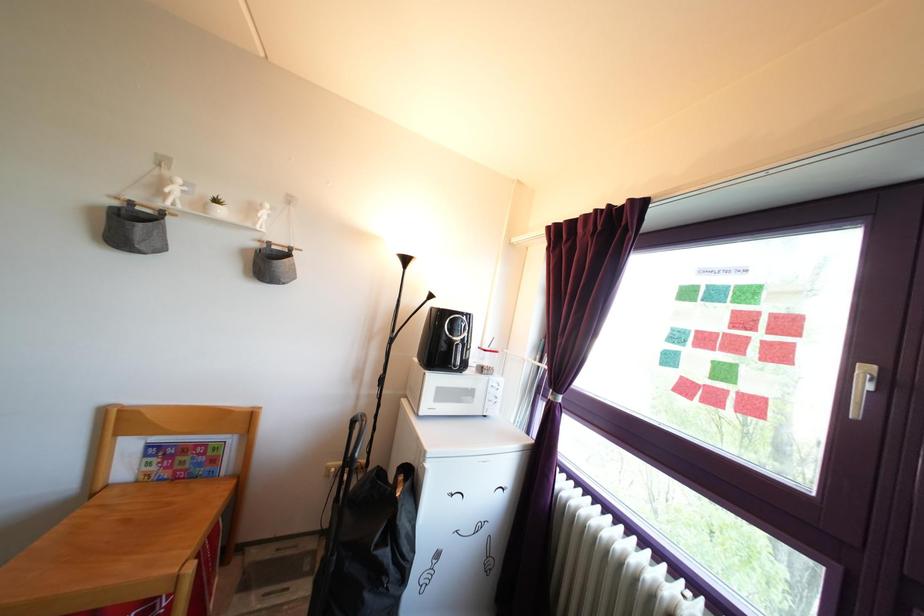
Find where to lift the small white pot. Please return your answer as a coordinate pair (x, y).

(215, 207)